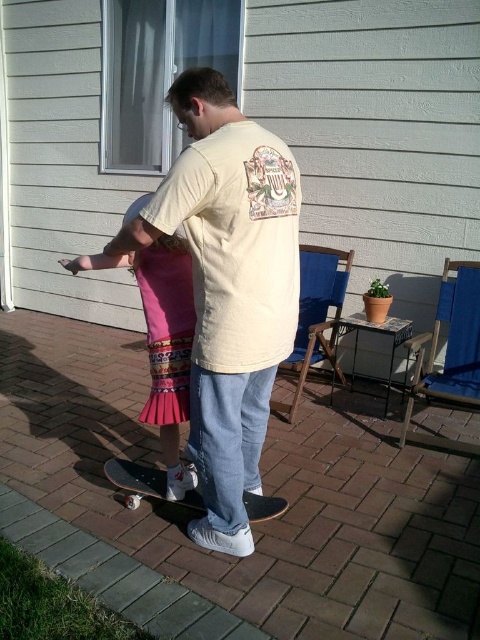
Where is `brick pavement at center`? brick pavement at center is located at coordinates (264, 492).

Identify the location of brick pavement at center. The image size is (480, 640). (264, 492).

Is pink pleated skirt at center positioned behind black matte skateboard at center?

No, pink pleated skirt at center is closer to the viewer.

Does point (156, 294) come behind point (132, 465)?

No.

The image size is (480, 640). Identify the location of pink pleated skirt at center. (164, 342).

Measure the distance from brick pavement at center to black matte skateboard at center.

brick pavement at center and black matte skateboard at center are 16.93 inches apart.

Locate an element on the screen. The width and height of the screenshot is (480, 640). brick pavement at center is located at coordinates (264, 492).